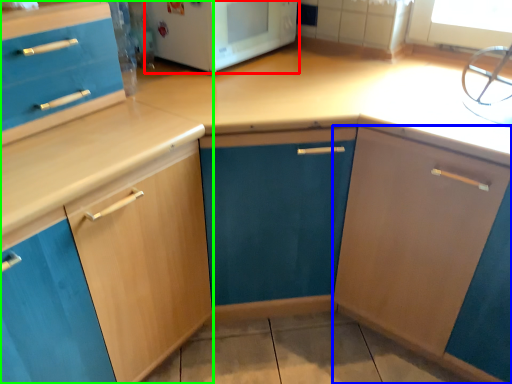
Question: Based on their relative distances, which object is nearer to home appliance (highlighted by a red box)? Choose from cabinetry (highlighted by a blue box) and cabinetry (highlighted by a green box).

Choices:
 (A) cabinetry
 (B) cabinetry

Answer: (B)